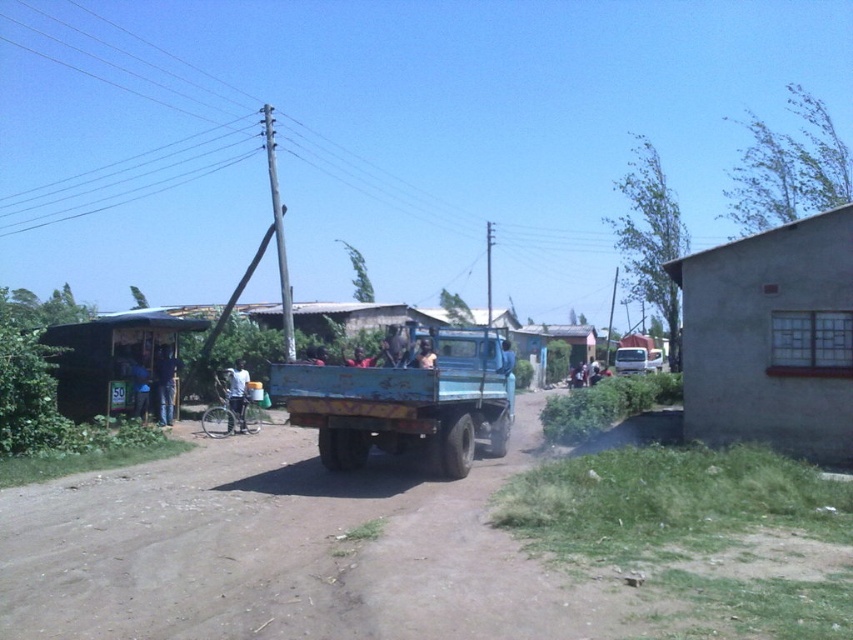
I want to click on wooden hut at left, so click(x=109, y=358).

Between wooden hut at left and white matte bicycle at center, which one appears on the left side from the viewer's perspective?

wooden hut at left is more to the left.

The width and height of the screenshot is (853, 640). Identify the location of wooden hut at left. (109, 358).

Where is `gray concrete hut at right`? The height and width of the screenshot is (640, 853). gray concrete hut at right is located at coordinates (770, 339).

Does gray concrete hut at right have a smaller size compared to white matte bicycle at center?

Actually, gray concrete hut at right might be larger than white matte bicycle at center.

The image size is (853, 640). Find the location of `gray concrete hut at right`. gray concrete hut at right is located at coordinates (x=770, y=339).

Which of these two, blue corrugated metal hut at center or white matte bicycle at center, stands taller?

blue corrugated metal hut at center

Is point (566, 369) more distant than point (242, 413)?

Yes, it is behind point (242, 413).

The image size is (853, 640). I want to click on blue corrugated metal hut at center, so pos(547,342).